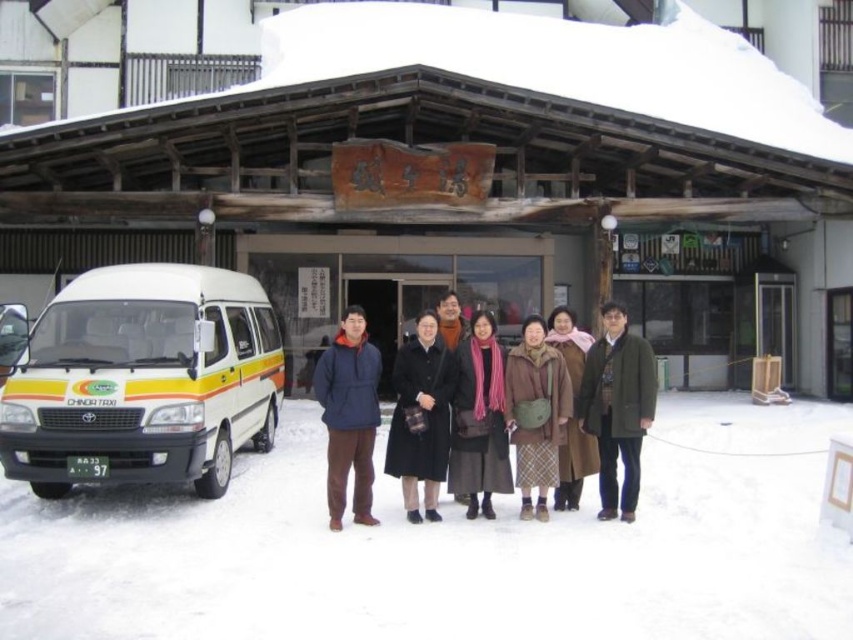
You are a delivery person who needs to park your vehicle near the traditional wooden building. The white glossy van at left is already parked there. Can you park your vehicle on the white powdery snow at lower center without overlapping the van?

The white powdery snow at lower center might be wider than the white glossy van at left, so there might be enough space to park your vehicle there without overlapping the van.

You are a tourist standing in front of the traditional wooden building and want to take a photo of the signboard. You have a black wool coat at center and a white glossy van at left. Which object is closer to the signboard?

The black wool coat at center is closer to the signboard because the white glossy van at left is positioned to the left of it, meaning the coat is between the van and the building.

You are a delivery person trying to park your 7 feet long truck in the space between the white powdery snow at lower center and the white glossy van at left. Can you fit your truck there?

The distance between the white powdery snow at lower center and the white glossy van at left is 6.95 feet, which is slightly less than your truck length of 7 feet. Therefore, your truck cannot fit in that space.